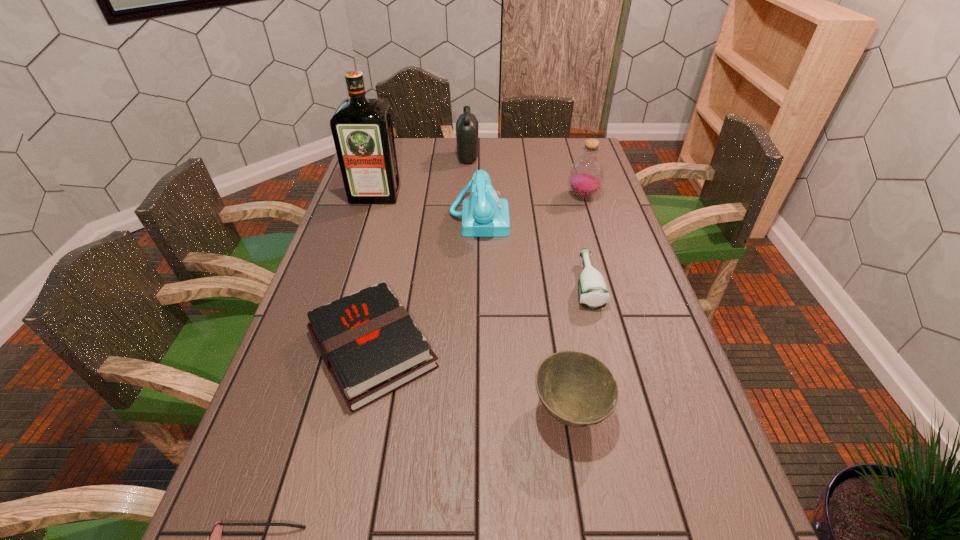
The image size is (960, 540). Find the location of `bottle identified as the second closest to the hardback book`. bottle identified as the second closest to the hardback book is located at coordinates (586, 175).

Find the location of `free location that satisfies the following two spatial constraints: 1. on the front label of the liquor; 2. on the right side of the second nearest bottle`. free location that satisfies the following two spatial constraints: 1. on the front label of the liquor; 2. on the right side of the second nearest bottle is located at coordinates (375, 196).

Locate an element on the screen. The image size is (960, 540). free point that satisfies the following two spatial constraints: 1. on the front label of the second farthest bottle; 2. on the right side of the tallest object is located at coordinates (375, 196).

The height and width of the screenshot is (540, 960). I want to click on vacant region that satisfies the following two spatial constraints: 1. on the back side of the bowl; 2. on the left side of the nearest bottle, so click(549, 285).

Where is `blank space that satisfies the following two spatial constraints: 1. on the back side of the fourth shortest object; 2. on the dial of the telephone`? blank space that satisfies the following two spatial constraints: 1. on the back side of the fourth shortest object; 2. on the dial of the telephone is located at coordinates (539, 218).